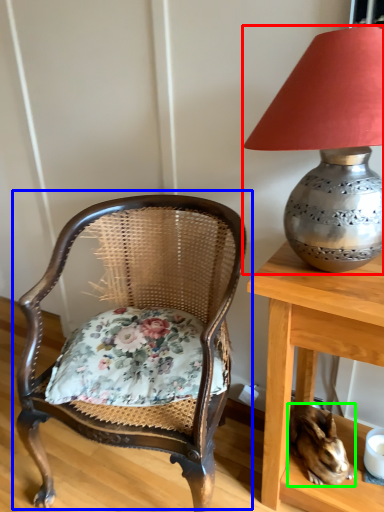
Question: Considering the real-world distances, which object is farthest from lamp (highlighted by a red box)? chair (highlighted by a blue box) or rabbit (highlighted by a green box)?

Choices:
 (A) chair
 (B) rabbit

Answer: (B)